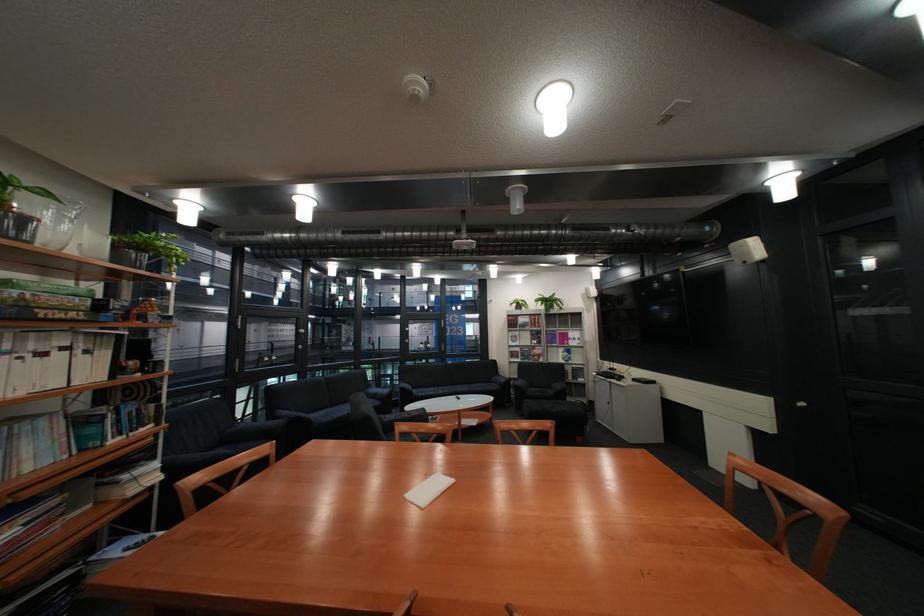
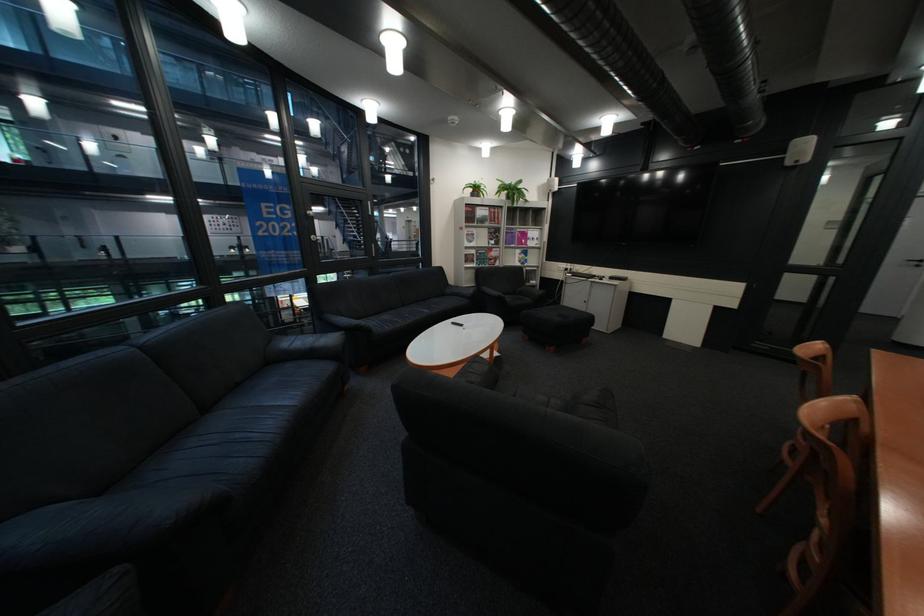
In the second image, find the point that corresponds to (x=546, y=334) in the first image.

(505, 233)